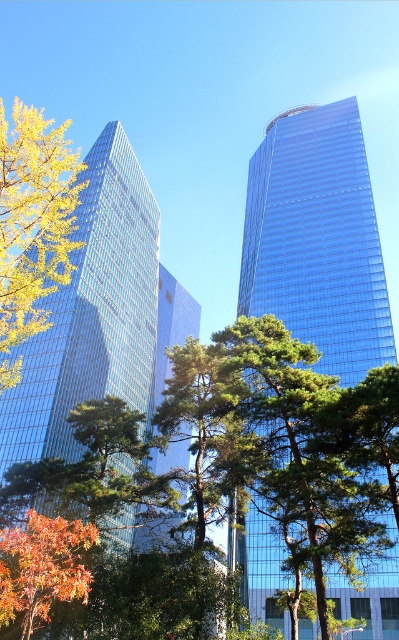
You are a drone operator who needs to fly a drone between the two skyscrapers. The drone has a maximum flight distance of 30 meters. Based on the scene, can the drone safely fly between the blue glassy skyscraper at center and the shiny glass skyscraper at left without exceeding its maximum flight distance?

The distance between the blue glassy skyscraper at center and the shiny glass skyscraper at left is 27.34 meters, which is within the drone operator s 30 meters maximum flight distance. Therefore, the drone can safely fly between them without exceeding its limit.

Looking at this image, you are a drone operator who needs to fly a drone between the shiny glass skyscraper at left and the blue glass building at center. The drone has a maximum flight distance of 25 meters. Can the drone safely fly between them without exceeding its range?

The shiny glass skyscraper at left and blue glass building at center are 25.63 meters apart. Since the distance between them is greater than the drone maximum flight distance of 25 meters, the drone cannot safely fly between them without exceeding its range.

In the scene shown: You are standing in the city square looking up at the two skyscrapers. Which one is positioned higher in the sky between the shiny glass skyscraper at left and the blue glass building at center?

The shiny glass skyscraper at left is positioned higher in the sky than the blue glass building at center.